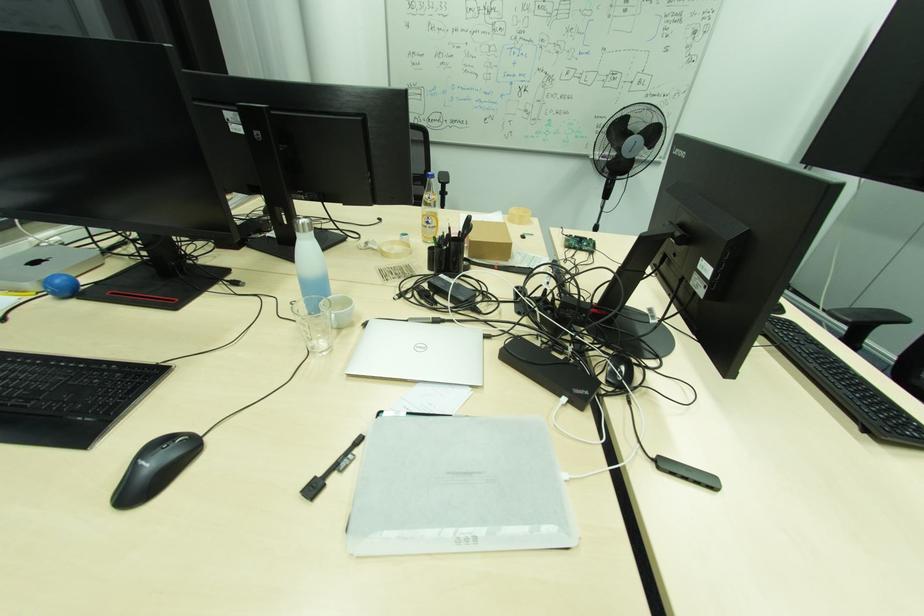
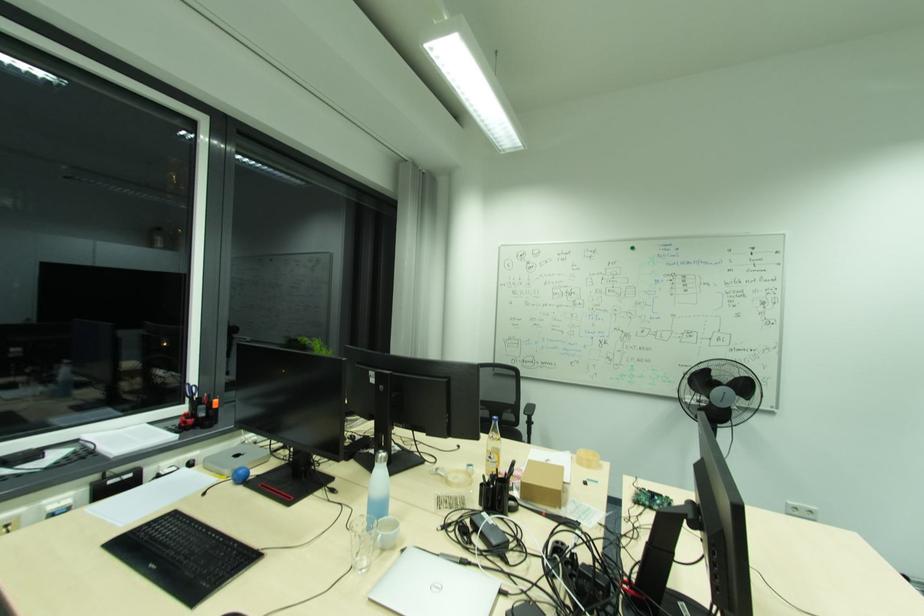
The point at (469,254) is marked in the first image. Where is the corresponding point in the second image?

(520, 495)